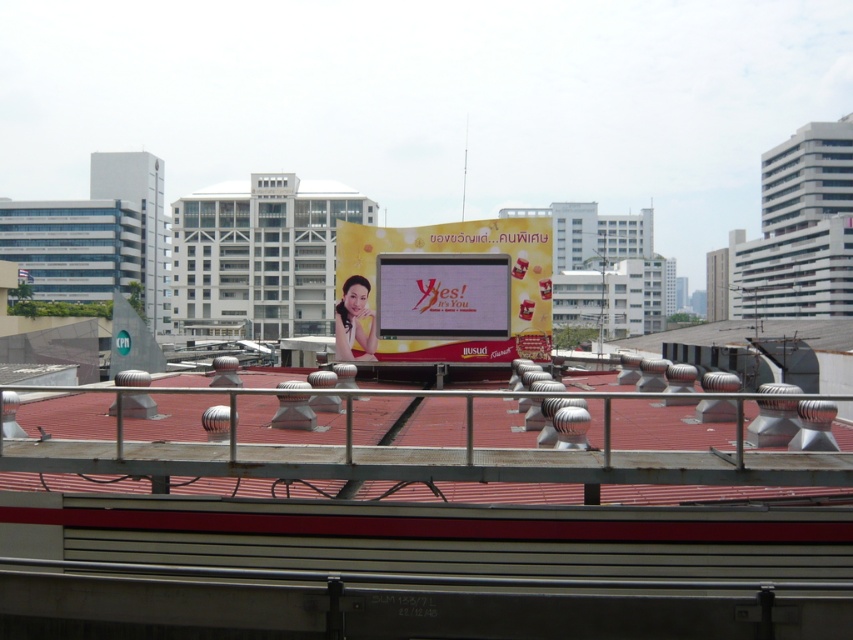
Is metal at center smaller than yellow fabric billboard at center?

Yes.

Describe the element at coordinates (412, 451) in the screenshot. I see `metal at center` at that location.

Who is more forward, (747, 464) or (495, 232)?

Point (747, 464) is more forward.

Locate an element on the screen. The image size is (853, 640). metal at center is located at coordinates (412, 451).